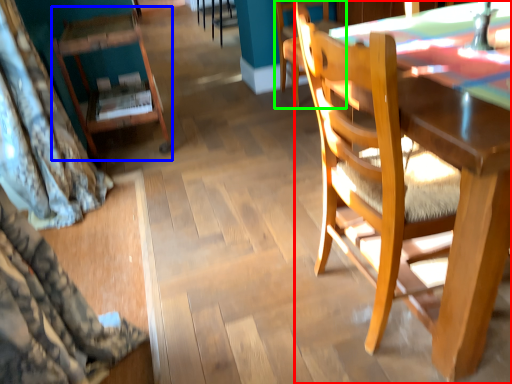
Question: Based on their relative distances, which object is nearer to chair (highlighted by a red box)? Choose from chair (highlighted by a blue box) and chair (highlighted by a green box).

Choices:
 (A) chair
 (B) chair

Answer: (A)